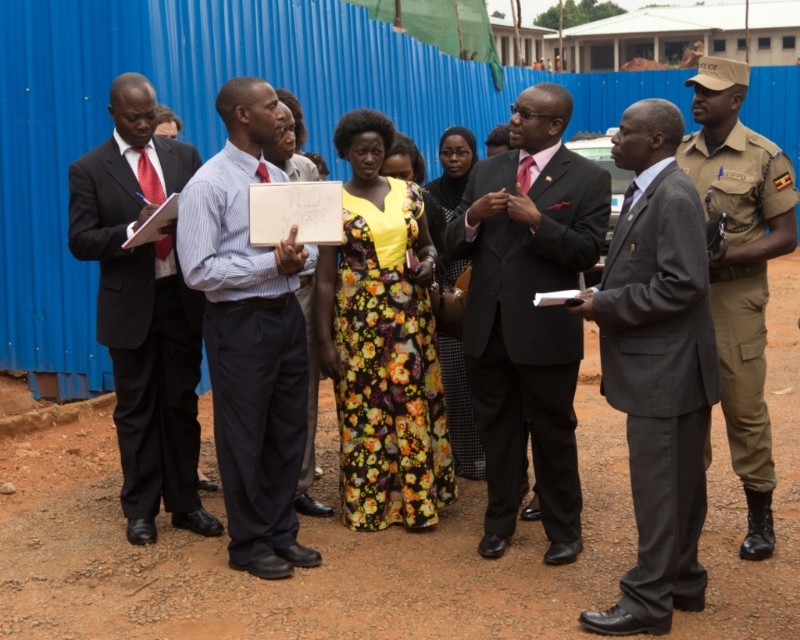
Which is in front, point (700, 211) or point (344, 205)?

Point (700, 211)

Who is positioned more to the left, dark gray suit at center or floral print dress at center?

From the viewer's perspective, floral print dress at center appears more on the left side.

Is point (629, 394) positioned in front of point (368, 237)?

Yes.

Identify the location of dark gray suit at center. (656, 368).

How much distance is there between blue striped shirt at center and khaki uniform at right?

7.53 feet

Between point (270, 257) and point (790, 173), which one is positioned in front?

Positioned in front is point (270, 257).

In order to click on blue striped shirt at center in this screenshot , I will do `click(250, 333)`.

Is floral print dress at center thinner than light blue shirt at center?

No, floral print dress at center is not thinner than light blue shirt at center.

In the scene shown: Is floral print dress at center to the left of light blue shirt at center from the viewer's perspective?

No, floral print dress at center is not to the left of light blue shirt at center.

Locate an element on the screen. floral print dress at center is located at coordinates (382, 340).